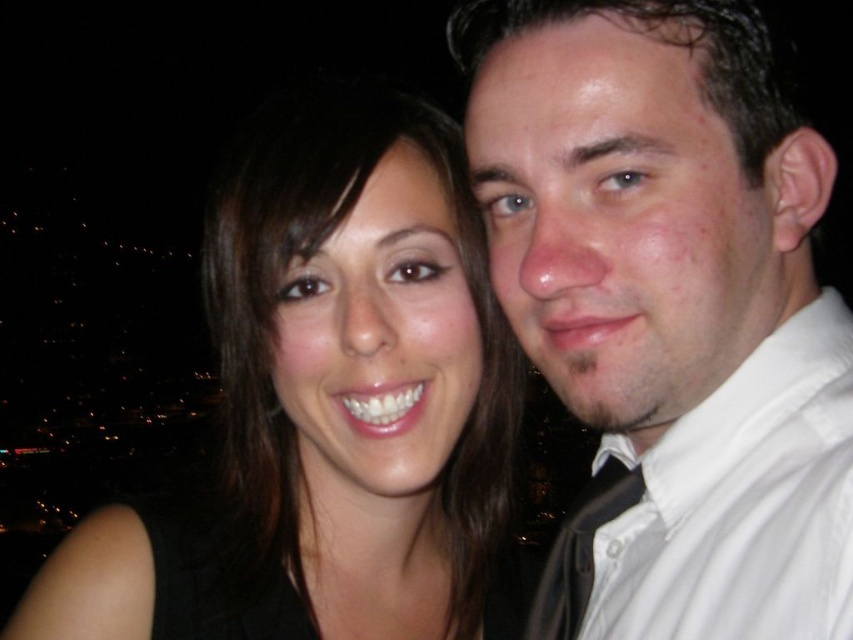
You are a photographer trying to adjust the focus of your camera. You want to ensure that both the white shirt at right and the black matte hair at upper left are in focus. Based on their positions, which one should you focus on first to achieve this?

You should focus on the white shirt at right first because it is in front of the black matte hair at upper left, so focusing on the closer object will help both be in focus.

You are standing at the position of point (755, 621) and want to move forward. Is there a point (469, 208) in front of you that you might collide with?

Point (469, 208) is behind point (755, 621), so there is no point in front of you at (755, 621) that you might collide with.

You are a photographer trying to adjust the lighting for a portrait. You notice the white shirt at right and the black matte hair at upper left in your frame. Which object should you focus your spotlight on if you want to highlight the narrower one?

The white shirt at right has a lesser width compared to the black matte hair at upper left, so you should focus the spotlight on the white shirt at right to highlight its narrower size.